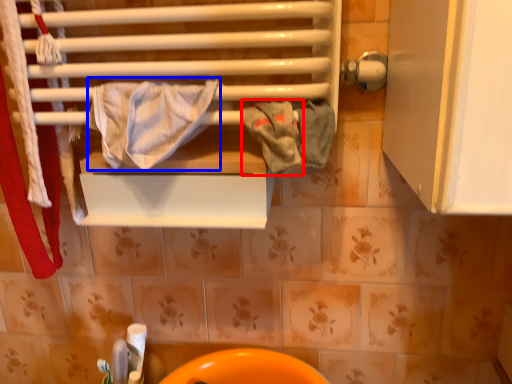
Question: Which object appears closest to the camera in this image, bath towel (highlighted by a red box) or bath towel (highlighted by a blue box)?

Choices:
 (A) bath towel
 (B) bath towel

Answer: (B)